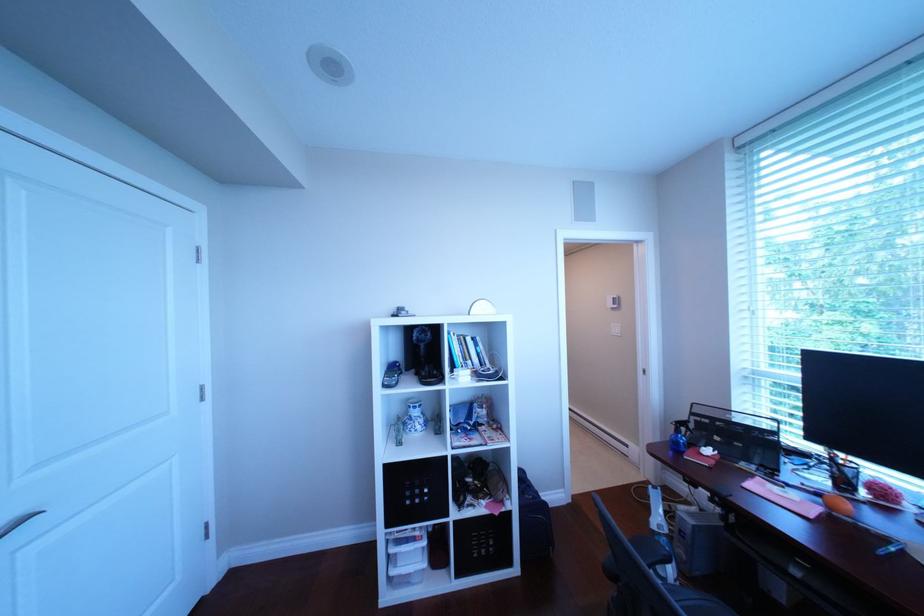
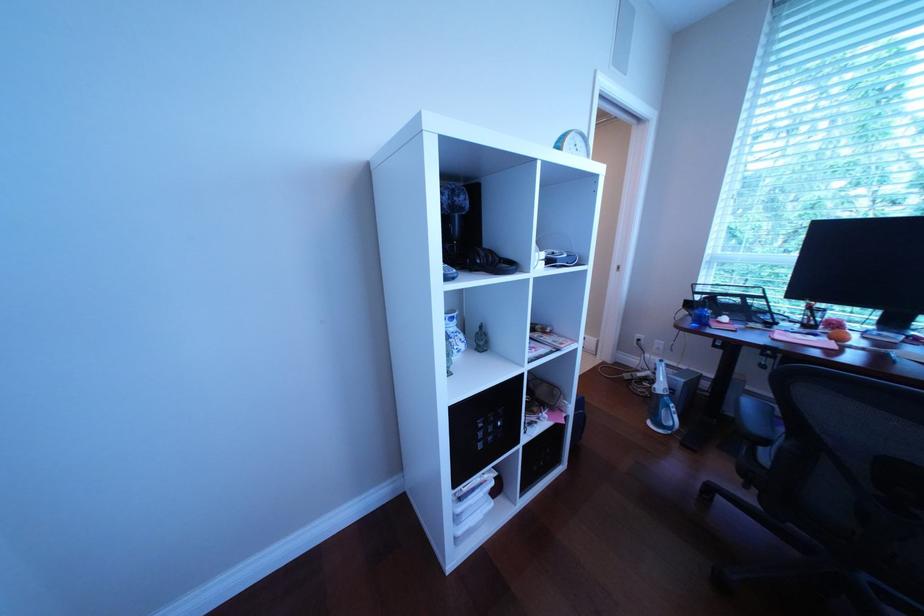
The images are taken continuously from a first-person perspective. In which direction are you moving?

The movement direction of the cameraman is left, forward.